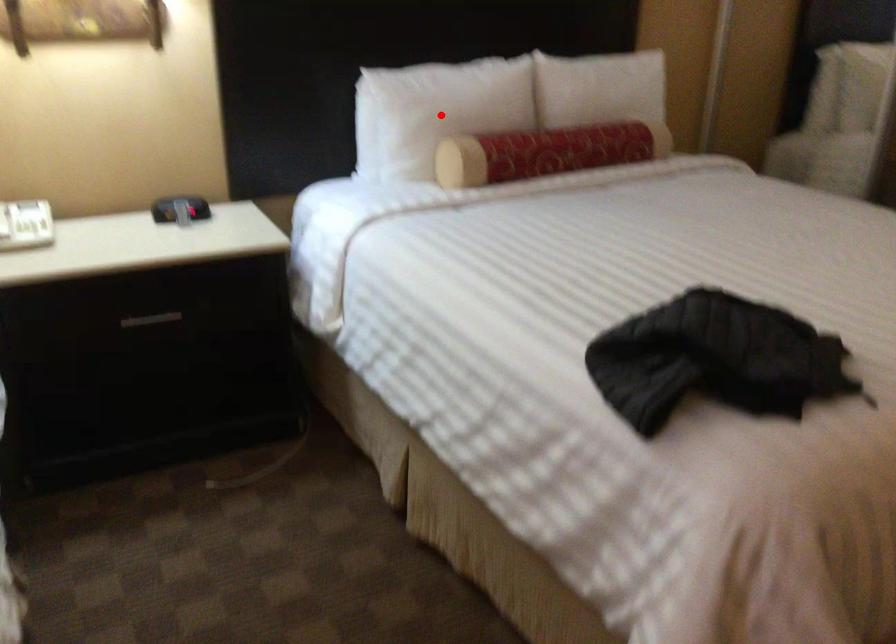
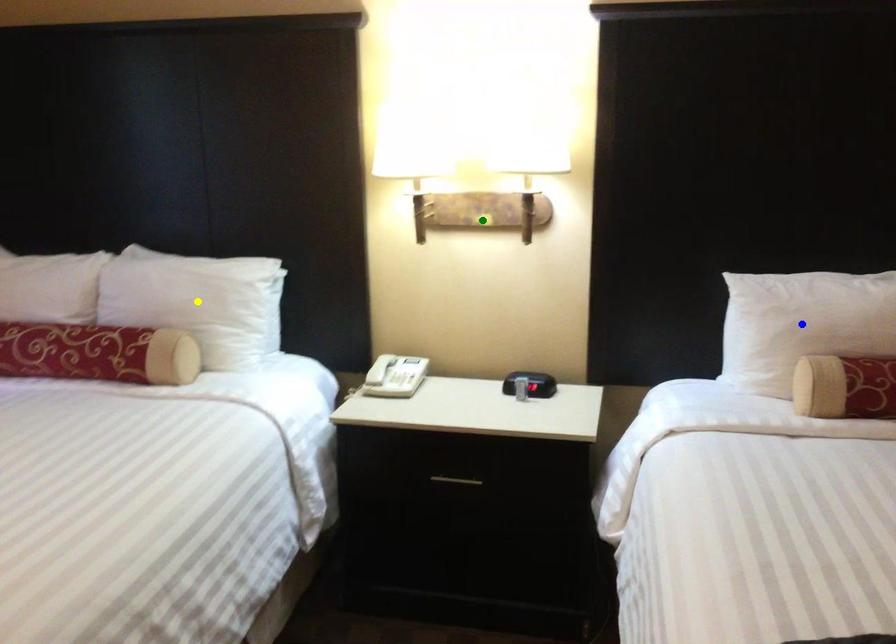
Question: I am providing you with two images of the same scene from different viewpoints. A red point is marked on the first image. You are given multiple points on the second image. Which spot in image 2 lines up with the point in image 1?

Choices:
 (A) green point
 (B) yellow point
 (C) blue point

Answer: (C)